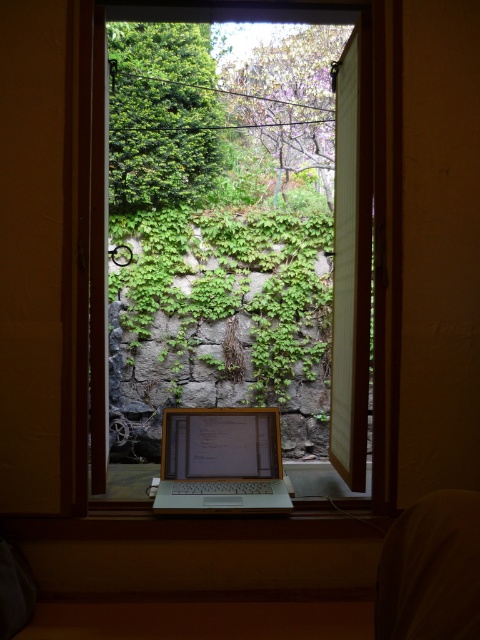
Can you confirm if green leafy ivy at upper left is bigger than dark fabric at lower right?

Yes.

Between green leafy ivy at upper left and dark fabric at lower right, which one is positioned lower?

dark fabric at lower right

Where is `green leafy ivy at upper left`? The image size is (480, 640). green leafy ivy at upper left is located at coordinates (162, 115).

The width and height of the screenshot is (480, 640). I want to click on green leafy ivy at upper left, so click(x=162, y=115).

Can you confirm if dark fabric at lower right is bigger than satin silver laptop at center?

No, dark fabric at lower right is not bigger than satin silver laptop at center.

Can you confirm if dark fabric at lower right is positioned to the left of satin silver laptop at center?

No, dark fabric at lower right is not to the left of satin silver laptop at center.

Who is more forward, (420,502) or (208,468)?

Point (420,502)

You are a GUI agent. You are given a task and a screenshot of the screen. Output one action in this format:
    pyautogui.click(x=<x>, y=<y>)
    Task: Click on the dark fabric at lower right
    This screenshot has width=480, height=640.
    Given the screenshot: What is the action you would take?
    pyautogui.click(x=431, y=570)

Is green leafy ivy at upper left smaller than satin silver laptop at center?

Actually, green leafy ivy at upper left might be larger than satin silver laptop at center.

Who is positioned more to the left, green leafy ivy at upper left or satin silver laptop at center?

From the viewer's perspective, green leafy ivy at upper left appears more on the left side.

Find the location of a particular element. green leafy ivy at upper left is located at coordinates (162, 115).

The image size is (480, 640). I want to click on green leafy ivy at upper left, so click(x=162, y=115).